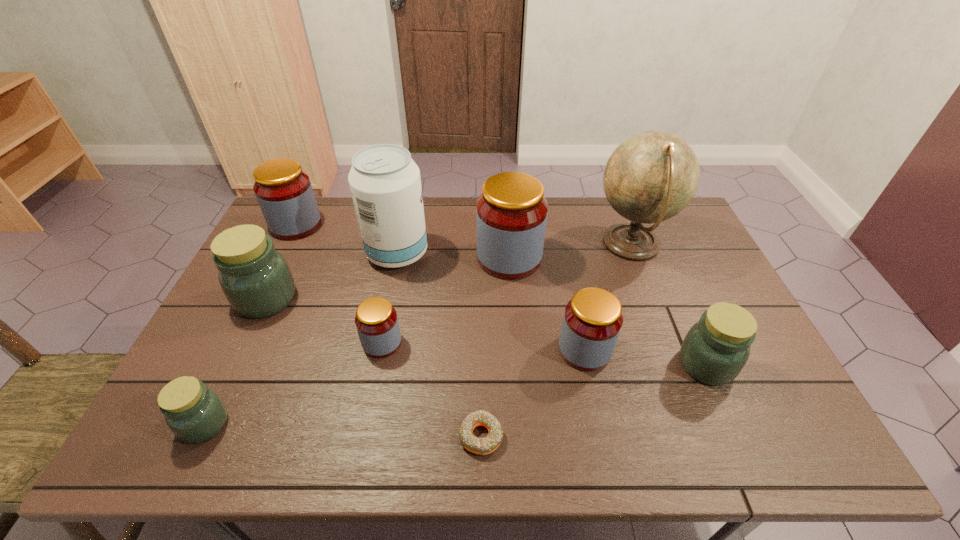
Identify the location of free region that satisfies the following two spatial constraints: 1. on the front side of the second smallest red jar; 2. on the left side of the rightmost green jar. (588, 364).